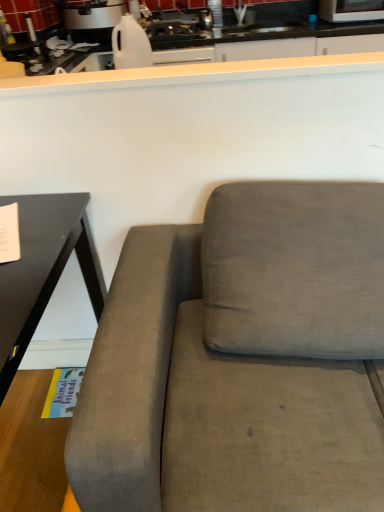
How much space does metallic silver microwave at upper right, which is counted as the first appliance, starting from the right, occupy vertically?

The height of metallic silver microwave at upper right, which is counted as the first appliance, starting from the right, is 15.22 centimeters.

Where is `white glossy rice cooker at upper left, marked as the 1th appliance in a left-to-right arrangement`? The width and height of the screenshot is (384, 512). white glossy rice cooker at upper left, marked as the 1th appliance in a left-to-right arrangement is located at coordinates (91, 19).

What do you see at coordinates (43, 270) in the screenshot? I see `matte black table at left` at bounding box center [43, 270].

In order to face matte black table at left, should I rotate leftwards or rightwards?

You should look left and rotate roughly 25.567 degrees.

You are a GUI agent. You are given a task and a screenshot of the screen. Output one action in this format:
    pyautogui.click(x=<x>, y=<y>)
    Task: Click on the matte gray couch at center
    This screenshot has height=512, width=384.
    Given the screenshot: What is the action you would take?
    pyautogui.click(x=240, y=359)

Is metallic silver microwave at upper right, the 2th appliance in the left-to-right sequence, placed right next to white smooth countertop at upper center?

No, metallic silver microwave at upper right, the 2th appliance in the left-to-right sequence, is not making contact with white smooth countertop at upper center.

From the picture: From the image's perspective, between metallic silver microwave at upper right, the 2th appliance in the left-to-right sequence, and white smooth countertop at upper center, which one is located above?

metallic silver microwave at upper right, the 2th appliance in the left-to-right sequence, is shown above in the image.

Is metallic silver microwave at upper right, the 2th appliance in the left-to-right sequence, at the left side of white smooth countertop at upper center?

Incorrect, metallic silver microwave at upper right, the 2th appliance in the left-to-right sequence, is not on the left side of white smooth countertop at upper center.

Is matte black table at left surrounding metallic silver microwave at upper right, which is counted as the first appliance, starting from the right?

Actually, metallic silver microwave at upper right, which is counted as the first appliance, starting from the right, is outside matte black table at left.

Based on the photo, is matte black table at left far away from metallic silver microwave at upper right, the 2th appliance in the left-to-right sequence?

matte black table at left is far away from metallic silver microwave at upper right, the 2th appliance in the left-to-right sequence.

Identify the location of the 2nd appliance behind when counting from the matte black table at left. (351, 10).

In the scene shown: Is matte black table at left aimed at metallic silver microwave at upper right, which is counted as the first appliance, starting from the right?

No.

Considering the sizes of objects white glossy rice cooker at upper left, acting as the second appliance starting from the right, and metallic silver microwave at upper right, the 2th appliance in the left-to-right sequence, in the image provided, who is bigger, white glossy rice cooker at upper left, acting as the second appliance starting from the right, or metallic silver microwave at upper right, the 2th appliance in the left-to-right sequence,?

white glossy rice cooker at upper left, acting as the second appliance starting from the right, is bigger.

From the image's perspective, relative to metallic silver microwave at upper right, which is counted as the first appliance, starting from the right, is white glossy rice cooker at upper left, marked as the 1th appliance in a left-to-right arrangement, above or below?

Clearly, from the image's perspective, white glossy rice cooker at upper left, marked as the 1th appliance in a left-to-right arrangement, is below metallic silver microwave at upper right, which is counted as the first appliance, starting from the right.

Is white glossy rice cooker at upper left, acting as the second appliance starting from the right, surrounding metallic silver microwave at upper right, the 2th appliance in the left-to-right sequence?

No, metallic silver microwave at upper right, the 2th appliance in the left-to-right sequence, is not a part of white glossy rice cooker at upper left, acting as the second appliance starting from the right.

Can you confirm if white glossy rice cooker at upper left, acting as the second appliance starting from the right, is thinner than metallic silver microwave at upper right, which is counted as the first appliance, starting from the right?

Incorrect, the width of white glossy rice cooker at upper left, acting as the second appliance starting from the right, is not less than that of metallic silver microwave at upper right, which is counted as the first appliance, starting from the right.

From a real-world perspective, is matte black table at left physically above white smooth countertop at upper center?

No, from a real-world perspective, matte black table at left is not over white smooth countertop at upper center

Is matte black table at left in front of white smooth countertop at upper center?

Yes, matte black table at left is in front of white smooth countertop at upper center.

This screenshot has width=384, height=512. What are the coordinates of `table located on the left of white smooth countertop at upper center` in the screenshot? It's located at (43, 270).

Considering the sizes of matte black table at left and white glossy rice cooker at upper left, marked as the 1th appliance in a left-to-right arrangement, in the image, is matte black table at left taller or shorter than white glossy rice cooker at upper left, marked as the 1th appliance in a left-to-right arrangement,?

In the image, matte black table at left appears to be taller than white glossy rice cooker at upper left, marked as the 1th appliance in a left-to-right arrangement.

Is matte black table at left to the left of white glossy rice cooker at upper left, marked as the 1th appliance in a left-to-right arrangement, from the viewer's perspective?

No, matte black table at left is not to the left of white glossy rice cooker at upper left, marked as the 1th appliance in a left-to-right arrangement.

Is matte black table at left facing towards white glossy rice cooker at upper left, marked as the 1th appliance in a left-to-right arrangement?

No, matte black table at left is not aimed at white glossy rice cooker at upper left, marked as the 1th appliance in a left-to-right arrangement.

From the image's perspective, is white smooth countertop at upper center on top of matte gray couch at center?

Correct, white smooth countertop at upper center appears higher than matte gray couch at center in the image.

How different are the orientations of white smooth countertop at upper center and matte gray couch at center in degrees?

There is a 0.000897-degree angle between the facing directions of white smooth countertop at upper center and matte gray couch at center.

Is white smooth countertop at upper center oriented away from matte gray couch at center?

That's not correct — white smooth countertop at upper center is not looking away from matte gray couch at center.

In the image, is white smooth countertop at upper center positioned in front of or behind matte gray couch at center?

Visually, white smooth countertop at upper center is located behind matte gray couch at center.

Who is bigger, matte gray couch at center or white smooth countertop at upper center?

matte gray couch at center is bigger.

Find the location of a particular element. counter top above the matte gray couch at center (from the image's perspective) is located at coordinates (194, 74).

Is matte gray couch at center taller or shorter than white smooth countertop at upper center?

Considering their sizes, matte gray couch at center has more height than white smooth countertop at upper center.

Considering the points (315, 259) and (328, 55), which point is in front, point (315, 259) or point (328, 55)?

The point (315, 259) is closer.

Locate an element on the screen. counter top that appears below the metallic silver microwave at upper right, which is counted as the first appliance, starting from the right (from the image's perspective) is located at coordinates (194, 74).

In order to click on table in front of the metallic silver microwave at upper right, the 2th appliance in the left-to-right sequence in this screenshot , I will do `click(43, 270)`.

Which object lies further to the anchor point matte gray couch at center, white glossy rice cooker at upper left, acting as the second appliance starting from the right, or white smooth countertop at upper center?

Among the two, white glossy rice cooker at upper left, acting as the second appliance starting from the right, is located further to matte gray couch at center.

Considering their positions, is white smooth countertop at upper center positioned closer to white glossy rice cooker at upper left, acting as the second appliance starting from the right, than matte black table at left?

white smooth countertop at upper center is positioned closer to the anchor white glossy rice cooker at upper left, acting as the second appliance starting from the right.

When comparing their distances from metallic silver microwave at upper right, which is counted as the first appliance, starting from the right, does white glossy rice cooker at upper left, acting as the second appliance starting from the right, or matte black table at left seem further?

matte black table at left is positioned further to the anchor metallic silver microwave at upper right, which is counted as the first appliance, starting from the right.

Which object lies further to the anchor point white smooth countertop at upper center, matte gray couch at center or white glossy rice cooker at upper left, marked as the 1th appliance in a left-to-right arrangement?

white glossy rice cooker at upper left, marked as the 1th appliance in a left-to-right arrangement, lies further to white smooth countertop at upper center than the other object.

Which object lies nearer to the anchor point matte gray couch at center, white smooth countertop at upper center or white glossy rice cooker at upper left, marked as the 1th appliance in a left-to-right arrangement?

Based on the image, white smooth countertop at upper center appears to be nearer to matte gray couch at center.

When comparing their distances from metallic silver microwave at upper right, which is counted as the first appliance, starting from the right, does white smooth countertop at upper center or matte black table at left seem further?

Based on the image, matte black table at left appears to be further to metallic silver microwave at upper right, which is counted as the first appliance, starting from the right.

Based on their spatial positions, is white smooth countertop at upper center or matte gray couch at center further from matte black table at left?

Among the two, white smooth countertop at upper center is located further to matte black table at left.

Based on their spatial positions, is matte gray couch at center or matte black table at left closer to white smooth countertop at upper center?

matte black table at left is closer to white smooth countertop at upper center.

I want to click on appliance between matte black table at left and metallic silver microwave at upper right, which is counted as the first appliance, starting from the right, along the z-axis, so click(x=91, y=19).

This screenshot has width=384, height=512. Identify the location of counter top between matte black table at left and white glossy rice cooker at upper left, marked as the 1th appliance in a left-to-right arrangement, along the z-axis. (194, 74).

This screenshot has width=384, height=512. Identify the location of counter top between matte gray couch at center and metallic silver microwave at upper right, the 2th appliance in the left-to-right sequence, in the front-back direction. (194, 74).

You are a GUI agent. You are given a task and a screenshot of the screen. Output one action in this format:
    pyautogui.click(x=<x>, y=<y>)
    Task: Click on the studio couch that lies between white smooth countertop at upper center and matte black table at left from top to bottom
    Image resolution: width=384 pixels, height=512 pixels.
    Given the screenshot: What is the action you would take?
    pyautogui.click(x=240, y=359)